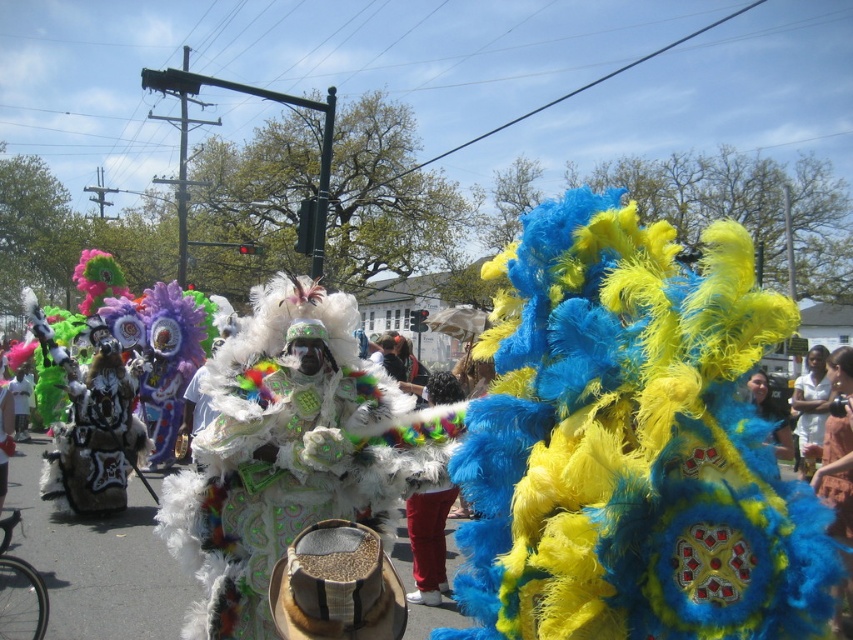
Who is shorter, white cotton shirt at right or matte blue feathered headdress at center?

Standing shorter between the two is matte blue feathered headdress at center.

Can you confirm if white cotton shirt at right is shorter than matte blue feathered headdress at center?

No.

This screenshot has height=640, width=853. Find the location of `white cotton shirt at right`. white cotton shirt at right is located at coordinates (810, 406).

I want to click on white cotton shirt at right, so click(810, 406).

Which is in front, point (424, 596) or point (755, 406)?

Point (755, 406) is in front.

Does red cotton pants at center have a lesser width compared to matte blue feathered headdress at center?

Yes, red cotton pants at center is thinner than matte blue feathered headdress at center.

Is point (456, 493) farther from camera compared to point (762, 406)?

Yes.

This screenshot has height=640, width=853. In order to click on red cotton pants at center in this screenshot , I will do `click(428, 541)`.

How far apart are red cotton pants at center and white cotton shirt at right?

red cotton pants at center is 3.75 meters from white cotton shirt at right.

Which is above, red cotton pants at center or white cotton shirt at right?

Positioned higher is white cotton shirt at right.

Is point (438, 376) positioned after point (817, 403)?

No.

You are a GUI agent. You are given a task and a screenshot of the screen. Output one action in this format:
    pyautogui.click(x=<x>, y=<y>)
    Task: Click on the red cotton pants at center
    This screenshot has width=853, height=640.
    Given the screenshot: What is the action you would take?
    pyautogui.click(x=428, y=541)